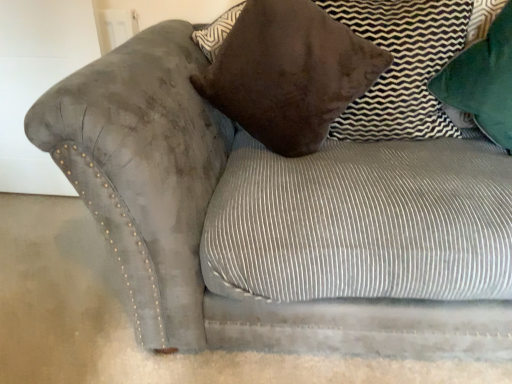
Question: Is brown suede pillow at upper right, which is counted as the 2th pillow, starting from the left, inside or outside of green velvet pillow at upper right, which ranks as the 3th pillow in left-to-right order?

Choices:
 (A) inside
 (B) outside

Answer: (B)

Question: Looking at their shapes, would you say brown suede pillow at upper right, which is counted as the 2th pillow, starting from the left, is wider or thinner than green velvet pillow at upper right, arranged as the first pillow when viewed from the right?

Choices:
 (A) thin
 (B) wide

Answer: (A)

Question: Which object is positioned closest to the brown suede pillow at upper right, which is counted as the 2th pillow, starting from the left?

Choices:
 (A) velvet brown pillow at upper center, marked as the first pillow in a left-to-right arrangement
 (B) green velvet pillow at upper right, arranged as the first pillow when viewed from the right

Answer: (B)

Question: Estimate the real-world distances between objects in this image. Which object is farther from the velvet brown pillow at upper center, which is counted as the 3th pillow, starting from the right?

Choices:
 (A) green velvet pillow at upper right, arranged as the first pillow when viewed from the right
 (B) brown suede pillow at upper right, which is counted as the 2th pillow, starting from the left

Answer: (A)